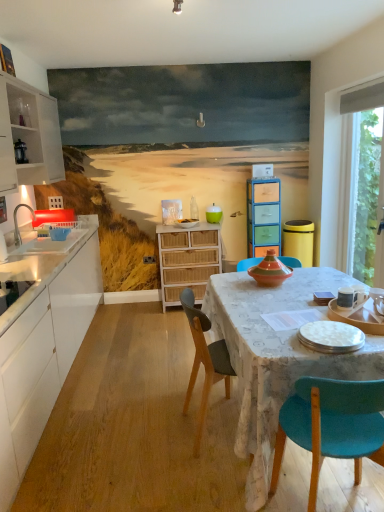
Question: Is matte wooden tray at center, which is the third tableware from front to back, shorter than white wood cabinet at left, the 3th cabinetry viewed from the right?

Choices:
 (A) yes
 (B) no

Answer: (A)

Question: Is matte wooden tray at center, the first tableware viewed from the back, placed right next to white wood cabinet at left, the first cabinetry when ordered from left to right?

Choices:
 (A) yes
 (B) no

Answer: (B)

Question: From the image's perspective, would you say matte wooden tray at center, which is counted as the third tableware, starting from the bottom, is shown under white wood cabinet at left, the first cabinetry when ordered from left to right?

Choices:
 (A) no
 (B) yes

Answer: (B)

Question: Can you confirm if matte wooden tray at center, the first tableware viewed from the back, is positioned to the right of white wood cabinet at left, the 3th cabinetry viewed from the right?

Choices:
 (A) yes
 (B) no

Answer: (A)

Question: Is matte wooden tray at center, positioned as the 3th tableware in right-to-left order, outside of white wood cabinet at left, the 3th cabinetry viewed from the right?

Choices:
 (A) yes
 (B) no

Answer: (A)

Question: Does matte wooden tray at center, the first tableware viewed from the back, turn towards white wood cabinet at left, the first cabinetry when ordered from left to right?

Choices:
 (A) no
 (B) yes

Answer: (A)

Question: Is white ceramic mug at upper right, marked as the 2th tableware in a front-to-back arrangement, oriented away from matte white sink at left?

Choices:
 (A) no
 (B) yes

Answer: (A)

Question: From a real-world perspective, is white ceramic mug at upper right, placed as the second tableware when sorted from top to bottom, physically above matte white sink at left?

Choices:
 (A) no
 (B) yes

Answer: (A)

Question: From the image's perspective, is white ceramic mug at upper right, which is the 1th tableware from right to left, below matte white sink at left?

Choices:
 (A) no
 (B) yes

Answer: (B)

Question: Does white ceramic mug at upper right, which is the 1th tableware from right to left, turn towards matte white sink at left?

Choices:
 (A) no
 (B) yes

Answer: (A)

Question: Does white ceramic mug at upper right, which is the 1th tableware from right to left, have a lesser width compared to matte white sink at left?

Choices:
 (A) yes
 (B) no

Answer: (A)

Question: Is white ceramic mug at upper right, which appears as the 3th tableware when viewed from the left, taller than matte white sink at left?

Choices:
 (A) no
 (B) yes

Answer: (A)

Question: Is white wood cabinet at left, the 3th cabinetry viewed from the right, next to white ceramic mug at upper right, marked as the 2th tableware in a front-to-back arrangement, and touching it?

Choices:
 (A) no
 (B) yes

Answer: (A)